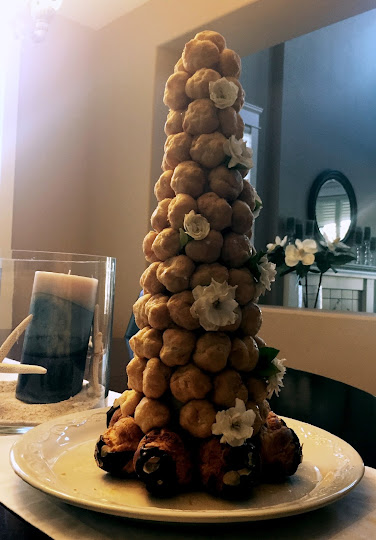
This screenshot has width=376, height=540. In order to click on plate in this screenshot , I will do (x=66, y=456), (x=322, y=483), (x=157, y=506).